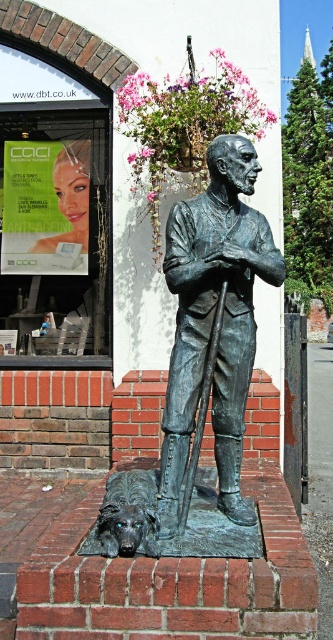
You are standing at the camera position and want to place a 10 feet long banner in front of the bronze statue at center. Can the banner be placed without overlapping the statue?

The bronze statue at center is 8.66 feet away from the camera. Since the banner is 10 feet long, it can be placed in front of the statue without overlapping as the distance is sufficient.

You are standing in front of the statue and want to know which of the two points, point (258, 227) or point (169, 541), is closer to you. Can you determine this based on their positions?

Result: Point (258, 227) is further to the camera than point (169, 541), so the closer point to you is point (169, 541).

You are a visitor standing in front of the statue and want to take a photo of both the bronze statue at center and the shiny bronze dog at lower left. Which object should you focus on first to ensure both are in frame?

The bronze statue at center is located above the shiny bronze dog at lower left, so you should focus on the bronze statue at center first to ensure both are in frame.